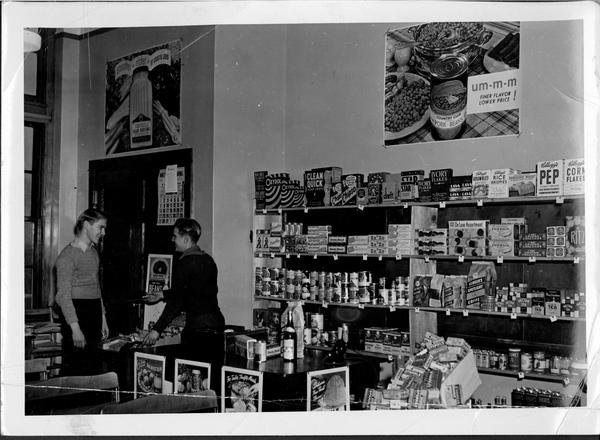
At what (x,y) coordinates should I click in order to perform the action: click on two doors. Please return your answer as a coordinate pair (x, y). This screenshot has height=440, width=600. Looking at the image, I should click on (131, 250).